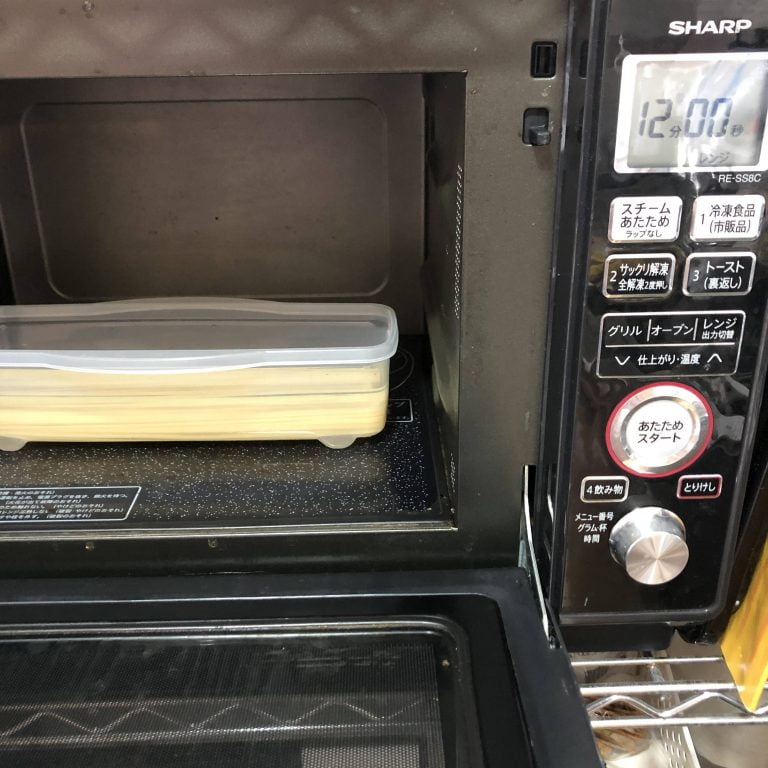
In order to click on glass on the front of an oven door in this screenshot , I will do `click(53, 710)`, `click(363, 709)`.